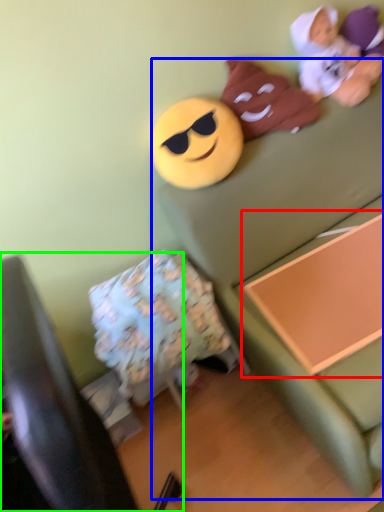
Question: Estimate the real-world distances between objects in this image. Which object is farther from changing table (highlighted by a red box), couch (highlighted by a blue box) or furniture (highlighted by a green box)?

Choices:
 (A) couch
 (B) furniture

Answer: (B)